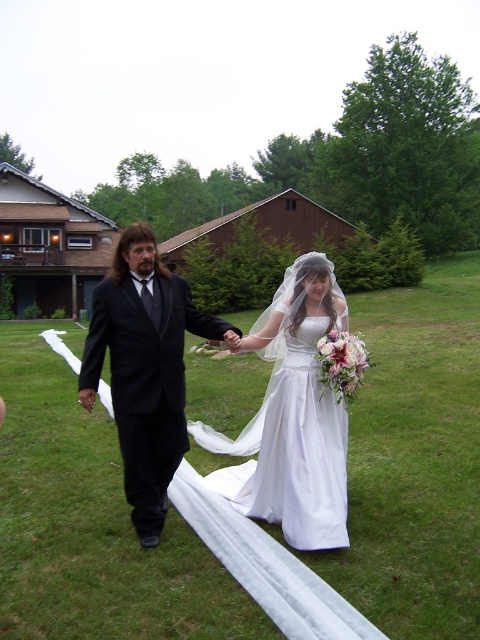
Measure the distance between white satin dress at center and camera.

The distance of white satin dress at center from camera is 3.48 meters.

Can you confirm if white satin dress at center is taller than matte black suit at center?

No, white satin dress at center is not taller than matte black suit at center.

Where is `white satin dress at center`? white satin dress at center is located at coordinates (291, 417).

Is matte black suit at center shorter than white satin veil at center?

No, matte black suit at center is not shorter than white satin veil at center.

In the scene shown: Between matte black suit at center and white satin veil at center, which one is positioned lower?

white satin veil at center is below.

Image resolution: width=480 pixels, height=640 pixels. Describe the element at coordinates (144, 369) in the screenshot. I see `matte black suit at center` at that location.

Identify the location of matte black suit at center. The width and height of the screenshot is (480, 640). (144, 369).

Consider the image. Can you confirm if white satin dress at center is wider than white satin veil at center?

Incorrect, white satin dress at center's width does not surpass white satin veil at center's.

In the scene shown: Does white satin dress at center appear on the left side of white satin veil at center?

No, white satin dress at center is not to the left of white satin veil at center.

Is point (301, 428) in front of point (58, 337)?

Yes.

Locate an element on the screen. white satin dress at center is located at coordinates (291, 417).